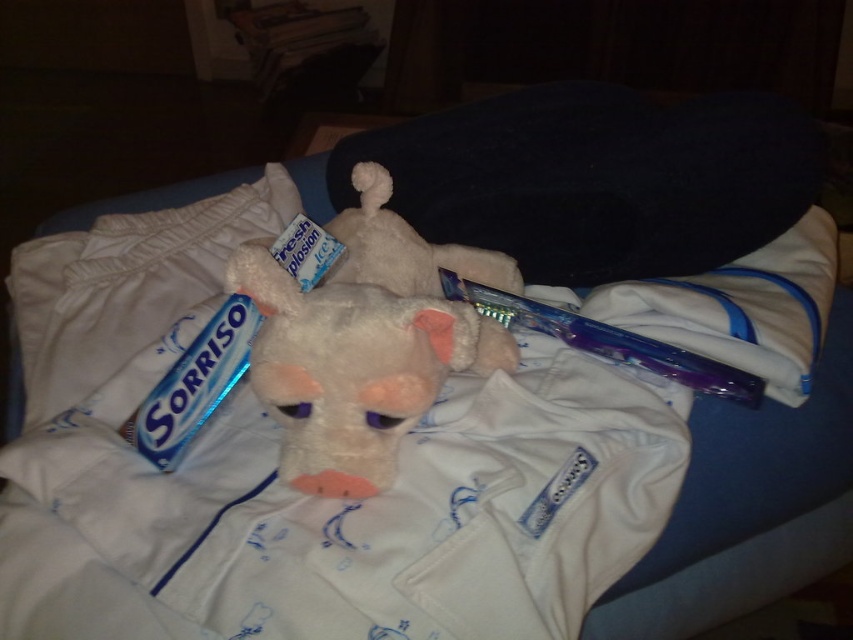
You are organizing items on a shelf and need to place both the fluffy white plush toy at center and the blue metallic toothpaste at lower left. If the shelf has limited width, which item should you place first to ensure both fit?

The fluffy white plush toy at center is wider than the blue metallic toothpaste at lower left, so place the toothpaste first to accommodate the wider toy.

You are a small robot with a 15 cm wide base. You need to move from the fluffy white plush toy at center to the purple glossy toothbrush at center. Can you fit through the space between them without moving either object?

The fluffy white plush toy at center is 18.25 centimeters away from the purple glossy toothbrush at center. Since your base is 15 cm wide, you can fit through the space between them as 18.25 cm is wider than 15 cm.